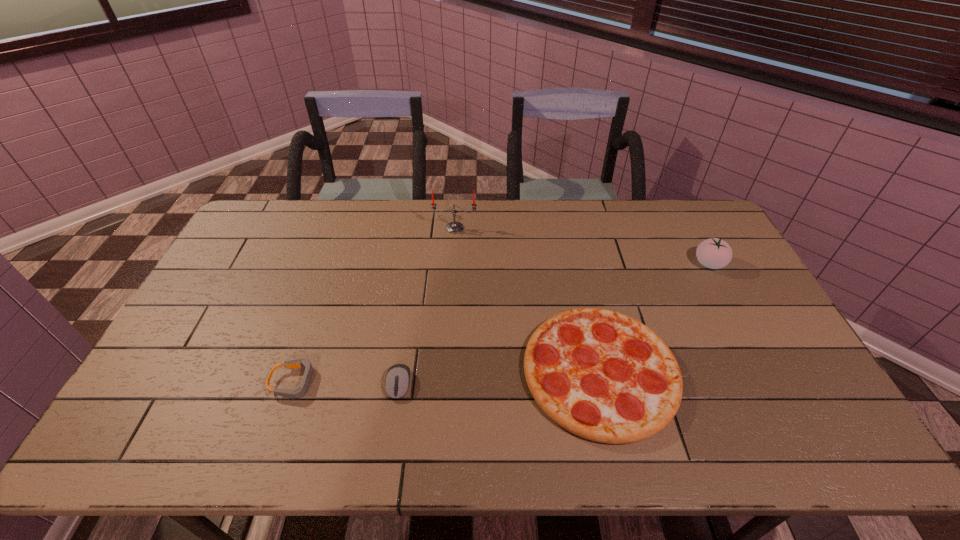
Where is `free area in between the pizza and the leftmost object`? This screenshot has height=540, width=960. free area in between the pizza and the leftmost object is located at coordinates (447, 377).

Find the location of a particular element. The width and height of the screenshot is (960, 540). vacant area that lies between the pizza and the computer equipment is located at coordinates (499, 378).

The width and height of the screenshot is (960, 540). Find the location of `free area in between the pizza and the candle`. free area in between the pizza and the candle is located at coordinates (527, 300).

In order to click on vacant area between the tallest object and the computer equipment in this screenshot , I will do `click(427, 306)`.

The image size is (960, 540). Find the location of `unoccupied position between the rightmost object and the leftmost object`. unoccupied position between the rightmost object and the leftmost object is located at coordinates (502, 323).

This screenshot has width=960, height=540. What are the coordinates of `unoccupied position between the rightmost object and the candle` in the screenshot? It's located at (582, 246).

In order to click on vacant point located between the second object from left to right and the farthest object in this screenshot , I will do pyautogui.click(x=427, y=306).

The width and height of the screenshot is (960, 540). Identify the location of free space between the pizza and the second farthest object. (655, 318).

At what (x,y) coordinates should I click in order to perform the action: click on vacant area that lies between the farthest object and the pizza. Please return your answer as a coordinate pair (x, y). This screenshot has width=960, height=540. Looking at the image, I should click on (527, 300).

I want to click on free space that is in between the tallest object and the leftmost object, so click(374, 305).